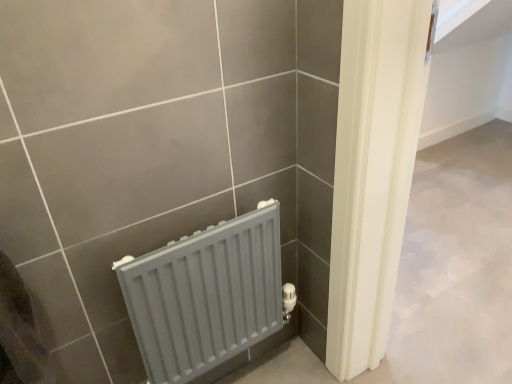
What do you see at coordinates (19, 333) in the screenshot? I see `matte plastic towel at lower left` at bounding box center [19, 333].

I want to click on matte plastic towel at lower left, so click(19, 333).

In order to click on gray matte radiator at lower left in this screenshot , I will do `click(206, 295)`.

In order to face gray matte radiator at lower left, should I rotate leftwards or rightwards?

You should rotate left by 6.693 degrees.

What do you see at coordinates (206, 295) in the screenshot?
I see `gray matte radiator at lower left` at bounding box center [206, 295].

At what (x,y) coordinates should I click in order to perform the action: click on matte plastic towel at lower left. Please return your answer as a coordinate pair (x, y). The image size is (512, 384). Looking at the image, I should click on (19, 333).

Considering the relative positions of matte plastic towel at lower left and gray matte radiator at lower left in the image provided, is matte plastic towel at lower left to the right of gray matte radiator at lower left from the viewer's perspective?

Incorrect, matte plastic towel at lower left is not on the right side of gray matte radiator at lower left.

Does matte plastic towel at lower left lie behind gray matte radiator at lower left?

No, the depth of matte plastic towel at lower left is less than that of gray matte radiator at lower left.

Considering the points (33, 351) and (161, 340), which point is in front, point (33, 351) or point (161, 340)?

The point (33, 351) is more forward.

From the image's perspective, which is above, matte plastic towel at lower left or gray matte radiator at lower left?

matte plastic towel at lower left appears higher in the image.

Looking at this image, from a real-world perspective, relative to gray matte radiator at lower left, is matte plastic towel at lower left vertically above or below?

Clearly, from a real-world perspective, matte plastic towel at lower left is above gray matte radiator at lower left.

Which object is thinner, matte plastic towel at lower left or gray matte radiator at lower left?

With smaller width is gray matte radiator at lower left.

Which of these two, matte plastic towel at lower left or gray matte radiator at lower left, stands taller?

gray matte radiator at lower left.

Considering the sizes of objects matte plastic towel at lower left and gray matte radiator at lower left in the image provided, who is bigger, matte plastic towel at lower left or gray matte radiator at lower left?

With larger size is gray matte radiator at lower left.

Is matte plastic towel at lower left not within gray matte radiator at lower left?

Yes, matte plastic towel at lower left is not within gray matte radiator at lower left.

Is matte plastic towel at lower left with gray matte radiator at lower left?

No, matte plastic towel at lower left is not touching gray matte radiator at lower left.

Is matte plastic towel at lower left oriented away from gray matte radiator at lower left?

No, matte plastic towel at lower left is not facing away from gray matte radiator at lower left.

How many degrees apart are the facing directions of matte plastic towel at lower left and gray matte radiator at lower left?

The facing directions of matte plastic towel at lower left and gray matte radiator at lower left are 0.362 degrees apart.

Measure the distance from matte plastic towel at lower left to gray matte radiator at lower left.

matte plastic towel at lower left is 13.70 inches from gray matte radiator at lower left.

Find the location of a particular element. The height and width of the screenshot is (384, 512). radiator directly beneath the matte plastic towel at lower left (from a real-world perspective) is located at coordinates (206, 295).

Is gray matte radiator at lower left to the left of matte plastic towel at lower left from the viewer's perspective?

Incorrect, gray matte radiator at lower left is not on the left side of matte plastic towel at lower left.

Does gray matte radiator at lower left lie in front of matte plastic towel at lower left?

No, gray matte radiator at lower left is further to the viewer.

Does point (255, 228) come farther from viewer compared to point (22, 291)?

Yes, it is.

From the image's perspective, which one is positioned higher, gray matte radiator at lower left or matte plastic towel at lower left?

From the image's view, matte plastic towel at lower left is above.

From a real-world perspective, which object stands above the other?

matte plastic towel at lower left, from a real-world perspective.

Considering the relative sizes of gray matte radiator at lower left and matte plastic towel at lower left in the image provided, is gray matte radiator at lower left wider than matte plastic towel at lower left?

No, gray matte radiator at lower left is not wider than matte plastic towel at lower left.

Who is taller, gray matte radiator at lower left or matte plastic towel at lower left?

Standing taller between the two is gray matte radiator at lower left.

Between gray matte radiator at lower left and matte plastic towel at lower left, which one has larger size?

gray matte radiator at lower left.

Would you say matte plastic towel at lower left is part of gray matte radiator at lower left's contents?

No, matte plastic towel at lower left is located outside of gray matte radiator at lower left.

Is there a large distance between gray matte radiator at lower left and matte plastic towel at lower left?

No, gray matte radiator at lower left is not far from matte plastic towel at lower left.

Is gray matte radiator at lower left oriented towards matte plastic towel at lower left?

No, gray matte radiator at lower left does not turn towards matte plastic towel at lower left.

What's the angular difference between gray matte radiator at lower left and matte plastic towel at lower left's facing directions?

The angular difference between gray matte radiator at lower left and matte plastic towel at lower left is 0.362 degrees.

The height and width of the screenshot is (384, 512). Find the location of `gray located in front of the gray matte radiator at lower left`. gray located in front of the gray matte radiator at lower left is located at coordinates (19, 333).

Where is `radiator that is under the matte plastic towel at lower left (from a real-world perspective)`? radiator that is under the matte plastic towel at lower left (from a real-world perspective) is located at coordinates (206, 295).

Image resolution: width=512 pixels, height=384 pixels. In order to click on gray above the gray matte radiator at lower left (from the image's perspective) in this screenshot , I will do `click(19, 333)`.